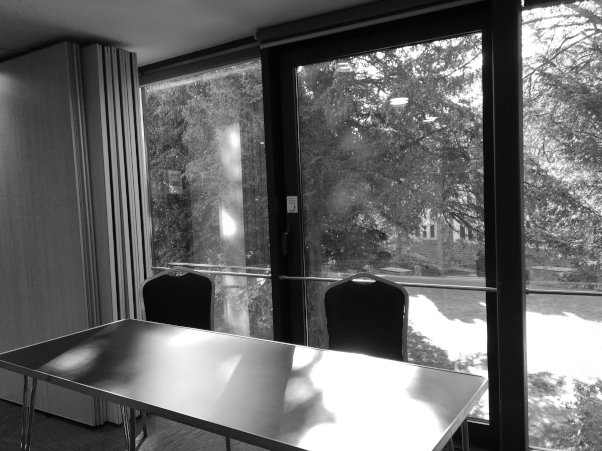
I want to click on the right top window glass, so click(581, 205).